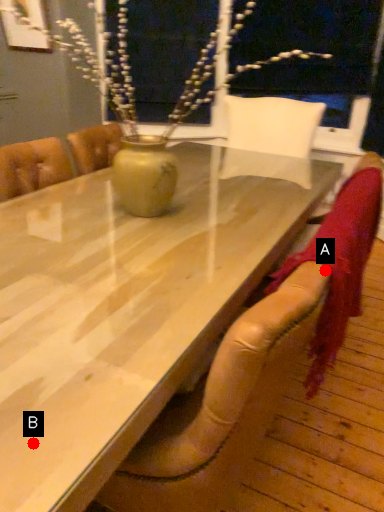
Question: Two points are circled on the image, labeled by A and B beside each circle. Which point is closer to the camera taking this photo?

Choices:
 (A) A is closer
 (B) B is closer

Answer: (B)